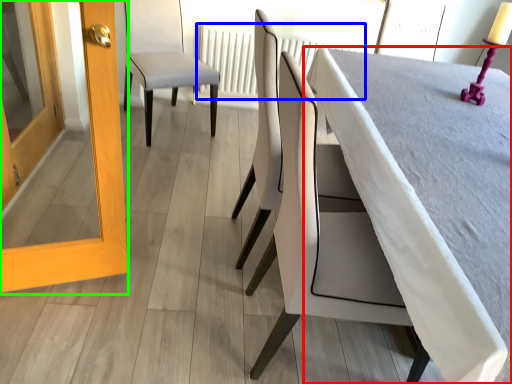
Question: Estimate the real-world distances between objects in this image. Which object is closer to table (highlighted by a red box), radiator (highlighted by a blue box) or screen door (highlighted by a green box)?

Choices:
 (A) radiator
 (B) screen door

Answer: (B)